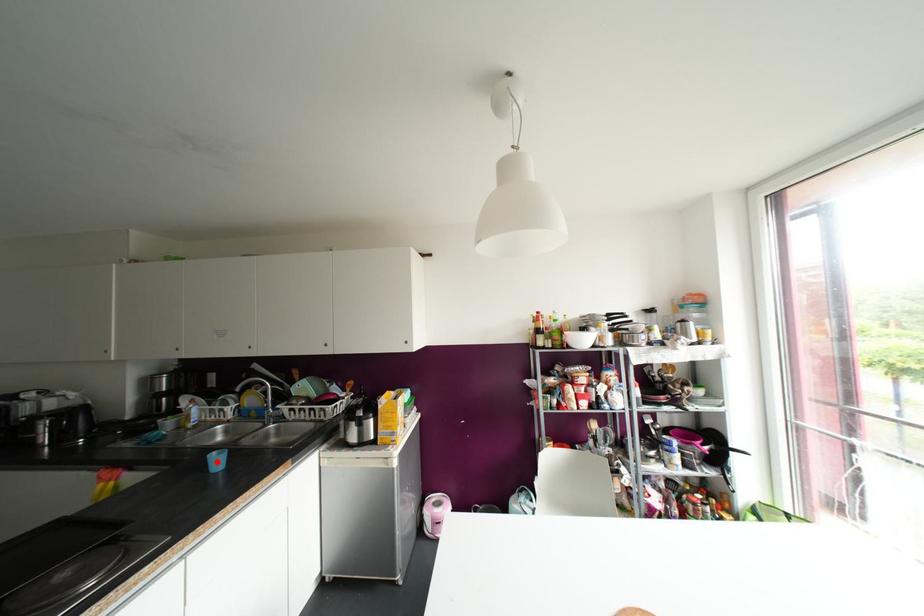
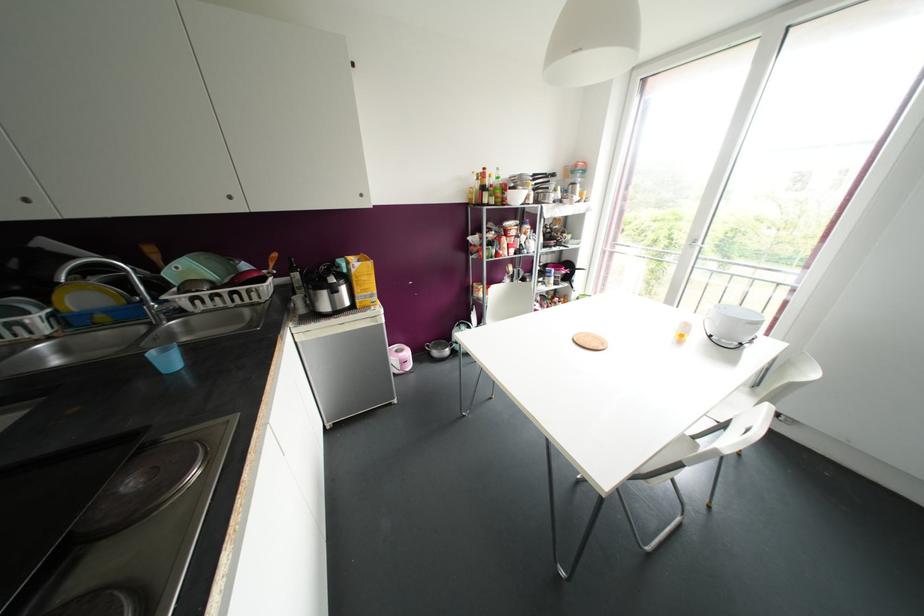
In the second image, find the point that corresponds to the highlighted location in the first image.

(168, 361)